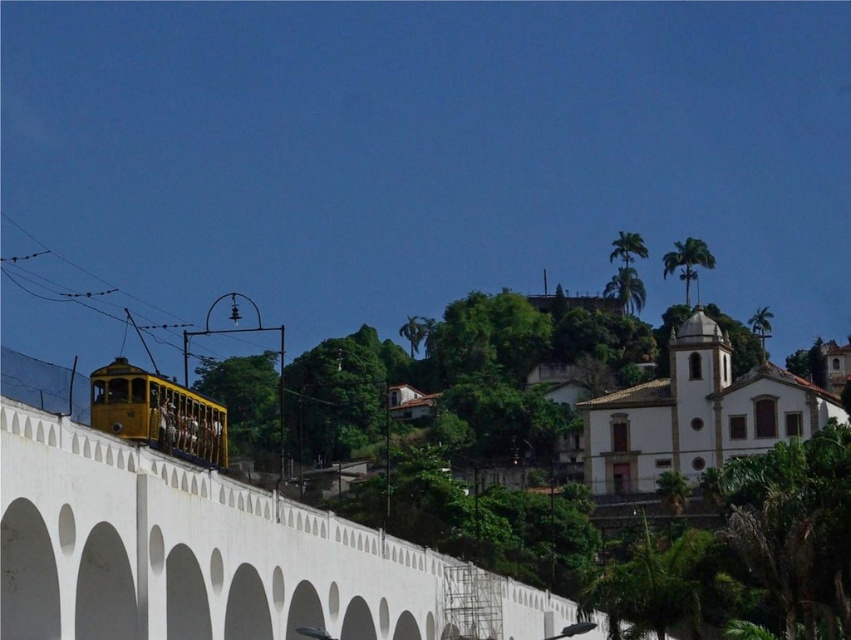
You are a passenger on the yellow polished metal tram at lower left and want to see the white concrete bridge at lower left through the window. Is the bridge visible from your current position?

The white concrete bridge at lower left is below the yellow polished metal tram at lower left, so it is not visible from the tram window.

You are an urban planner analyzing the layout of this city. You need to place a new public bench near the white concrete bridge at lower left. What are the coordinates where you should place it?

The white concrete bridge at lower left is located at coordinates point (215, 556), so the new bench should be placed near those coordinates.